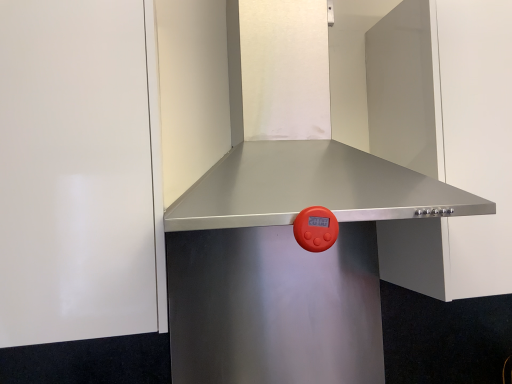
Question: Can you confirm if stainless steel vent at center is taller than white glossy door at upper left, the second door in the right-to-left sequence?

Choices:
 (A) yes
 (B) no

Answer: (B)

Question: Considering the relative positions of stainless steel vent at center and white glossy door at upper left, which appears as the 1th door when viewed from the left, in the image provided, is stainless steel vent at center to the right of white glossy door at upper left, which appears as the 1th door when viewed from the left, from the viewer's perspective?

Choices:
 (A) yes
 (B) no

Answer: (A)

Question: Is white glossy door at upper left, the second door in the right-to-left sequence, inside stainless steel vent at center?

Choices:
 (A) no
 (B) yes

Answer: (A)

Question: Is stainless steel vent at center directly adjacent to white glossy door at upper left, the second door in the right-to-left sequence?

Choices:
 (A) no
 (B) yes

Answer: (A)

Question: Is stainless steel vent at center turned away from white glossy door at upper left, which appears as the 1th door when viewed from the left?

Choices:
 (A) no
 (B) yes

Answer: (A)

Question: Can you confirm if stainless steel vent at center is smaller than white glossy door at upper left, the second door in the right-to-left sequence?

Choices:
 (A) yes
 (B) no

Answer: (B)

Question: Does white glossy door at upper left, the second door in the right-to-left sequence, contain stainless steel range hood at upper center, the 1th door viewed from the right?

Choices:
 (A) no
 (B) yes

Answer: (A)

Question: Considering the relative sizes of white glossy door at upper left, which appears as the 1th door when viewed from the left, and stainless steel range hood at upper center, the 1th door viewed from the right, in the image provided, is white glossy door at upper left, which appears as the 1th door when viewed from the left, taller than stainless steel range hood at upper center, the 1th door viewed from the right,?

Choices:
 (A) no
 (B) yes

Answer: (B)

Question: Is white glossy door at upper left, which appears as the 1th door when viewed from the left, next to stainless steel range hood at upper center, the 1th door viewed from the right?

Choices:
 (A) yes
 (B) no

Answer: (B)

Question: Is white glossy door at upper left, the second door in the right-to-left sequence, not close to stainless steel range hood at upper center, placed as the second door when sorted from left to right?

Choices:
 (A) yes
 (B) no

Answer: (B)

Question: Is white glossy door at upper left, the second door in the right-to-left sequence, to the right of stainless steel range hood at upper center, the 1th door viewed from the right, from the viewer's perspective?

Choices:
 (A) yes
 (B) no

Answer: (B)

Question: From a real-world perspective, does white glossy door at upper left, which appears as the 1th door when viewed from the left, stand above stainless steel range hood at upper center, the 1th door viewed from the right?

Choices:
 (A) yes
 (B) no

Answer: (A)

Question: Is stainless steel range hood at upper center, the 1th door viewed from the right, smaller than stainless steel vent at center?

Choices:
 (A) no
 (B) yes

Answer: (B)